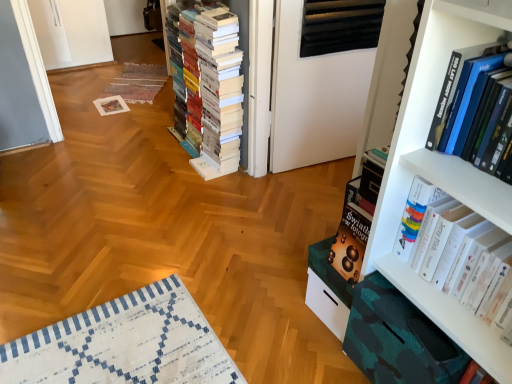
Describe the element at coordinates (441, 172) in the screenshot. The width and height of the screenshot is (512, 384). I see `white matte bookcase at right` at that location.

At what (x,y) coordinates should I click in order to perform the action: click on white matte bookcase at right. Please return your answer as a coordinate pair (x, y). Looking at the image, I should click on (441, 172).

Where is `white matte bookcase at right`? Image resolution: width=512 pixels, height=384 pixels. white matte bookcase at right is located at coordinates (441, 172).

Is white matte book at center, acting as the first book starting from the left, aimed at hardcover book at upper right, the third book in the back-to-front sequence?

No, white matte book at center, acting as the first book starting from the left, is not aimed at hardcover book at upper right, the third book in the back-to-front sequence.

Considering the sizes of white matte book at center, acting as the first book starting from the left, and hardcover book at upper right, the 2th book positioned from the left, in the image, is white matte book at center, acting as the first book starting from the left, wider or thinner than hardcover book at upper right, the 2th book positioned from the left,?

In the image, white matte book at center, acting as the first book starting from the left, appears to be wider than hardcover book at upper right, the 2th book positioned from the left.

Measure the distance from white matte book at center, the 3th book in the right-to-left sequence, to hardcover book at upper right, the 2th book positioned from the left.

A distance of 4.71 feet exists between white matte book at center, the 3th book in the right-to-left sequence, and hardcover book at upper right, the 2th book positioned from the left.

Considering the relative positions of white glossy book at right, which ranks as the 1th book in right-to-left order, and hardcover book at upper right, acting as the 1th book starting from the front, in the image provided, is white glossy book at right, which ranks as the 1th book in right-to-left order, to the right of hardcover book at upper right, acting as the 1th book starting from the front, from the viewer's perspective?

Yes.

Between white glossy book at right, positioned as the third book in left-to-right order, and hardcover book at upper right, acting as the 1th book starting from the front, which one has less height?

With less height is hardcover book at upper right, acting as the 1th book starting from the front.

How different are the orientations of white glossy book at right, which is the second book in front-to-back order, and hardcover book at upper right, the third book in the back-to-front sequence, in degrees?

The angle between the facing direction of white glossy book at right, which is the second book in front-to-back order, and the facing direction of hardcover book at upper right, the third book in the back-to-front sequence, is 0.000636 degrees.

Between point (425, 9) and point (215, 150), which one is positioned in front?

The point (425, 9) is in front.

Could you tell me if white matte bookcase at right is turned towards white matte book at center, the first book viewed from the back?

No.

Could white matte book at center, which appears as the third book when viewed from the front, be considered to be inside white matte bookcase at right?

Definitely not — white matte book at center, which appears as the third book when viewed from the front, is not inside white matte bookcase at right.

Considering the sizes of objects hardcover book at upper right, the 2th book positioned from the left, and white matte bookcase at right in the image provided, who is bigger, hardcover book at upper right, the 2th book positioned from the left, or white matte bookcase at right?

With larger size is white matte bookcase at right.

From the image's perspective, does hardcover book at upper right, the 2th book positioned from the left, appear higher than white matte bookcase at right?

No, from the image's perspective, hardcover book at upper right, the 2th book positioned from the left, is not above white matte bookcase at right.

Is hardcover book at upper right, the third book in the back-to-front sequence, beside white matte bookcase at right?

hardcover book at upper right, the third book in the back-to-front sequence, and white matte bookcase at right are clearly separated.

Looking at their sizes, would you say hardcover book at upper right, acting as the 1th book starting from the front, is wider or thinner than white matte bookcase at right?

Clearly, hardcover book at upper right, acting as the 1th book starting from the front, has more width compared to white matte bookcase at right.

Is white matte bookcase at right next to white glossy book at right, positioned as the third book in left-to-right order?

No, white matte bookcase at right is not in contact with white glossy book at right, positioned as the third book in left-to-right order.

Is white matte bookcase at right closer to camera compared to white glossy book at right, positioned as the third book in left-to-right order?

That is False.

Considering the sizes of objects white matte bookcase at right and white glossy book at right, the second book when ordered from back to front, in the image provided, who is thinner, white matte bookcase at right or white glossy book at right, the second book when ordered from back to front,?

white matte bookcase at right.

From the image's perspective, would you say white matte bookcase at right is positioned over white glossy book at right, which is the second book in front-to-back order?

Yes.

Does white matte book at center, the first book viewed from the back, come behind white glossy book at right, positioned as the third book in left-to-right order?

Yes, it is behind white glossy book at right, positioned as the third book in left-to-right order.

Is white matte book at center, acting as the first book starting from the left, positioned beyond the bounds of white glossy book at right, positioned as the third book in left-to-right order?

white matte book at center, acting as the first book starting from the left, lies outside white glossy book at right, positioned as the third book in left-to-right order,'s area.

Is white matte book at center, acting as the first book starting from the left, next to white glossy book at right, the second book when ordered from back to front, and touching it?

No, white matte book at center, acting as the first book starting from the left, is not next to white glossy book at right, the second book when ordered from back to front.

Is white matte book at center, acting as the first book starting from the left, facing towards white matte bookcase at right?

No, white matte book at center, acting as the first book starting from the left, is not facing towards white matte bookcase at right.

How much distance is there between white matte book at center, the first book viewed from the back, and white matte bookcase at right?

white matte book at center, the first book viewed from the back, and white matte bookcase at right are 4.53 feet apart.

From a real-world perspective, is white matte book at center, the 3th book in the right-to-left sequence, positioned under white matte bookcase at right based on gravity?

Yes, from a real-world perspective, white matte book at center, the 3th book in the right-to-left sequence, is beneath white matte bookcase at right.

Which of these two, white matte book at center, acting as the first book starting from the left, or white matte bookcase at right, stands taller?

Standing taller between the two is white matte bookcase at right.

Locate an element on the screen. The image size is (512, 384). the 2nd book positioned below the hardcover book at upper right, the third book in the back-to-front sequence (from a real-world perspective) is located at coordinates (213, 85).

There is a white glossy book at right, which is the second book in front-to-back order. Identify the location of the 1st book above it (from the image's perspective). (462, 92).

When comparing their distances from hardcover book at upper right, the third book in the back-to-front sequence, does white matte bookcase at right or white glossy book at right, positioned as the third book in left-to-right order, seem further?

Based on the image, white glossy book at right, positioned as the third book in left-to-right order, appears to be further to hardcover book at upper right, the third book in the back-to-front sequence.

In the scene shown: When comparing their distances from white glossy book at right, which ranks as the 1th book in right-to-left order, does hardcover book at upper right, the 2th book positioned from the left, or white matte bookcase at right seem closer?

white matte bookcase at right.

Estimate the real-world distances between objects in this image. Which object is further from white matte book at center, acting as the first book starting from the left, white glossy book at right, which is the second book in front-to-back order, or hardcover book at upper right, the second book in the right-to-left sequence?

hardcover book at upper right, the second book in the right-to-left sequence.

Based on their spatial positions, is white matte bookcase at right or white matte book at center, which appears as the third book when viewed from the front, closer to white glossy book at right, the second book when ordered from back to front?

The object closer to white glossy book at right, the second book when ordered from back to front, is white matte bookcase at right.

From the image, which object appears to be farther from white matte bookcase at right, white matte book at center, acting as the first book starting from the left, or hardcover book at upper right, acting as the 1th book starting from the front?

white matte book at center, acting as the first book starting from the left, lies further to white matte bookcase at right than the other object.

Consider the image. Considering their positions, is white matte bookcase at right positioned further to white glossy book at right, positioned as the third book in left-to-right order, than hardcover book at upper right, acting as the 1th book starting from the front?

hardcover book at upper right, acting as the 1th book starting from the front, is further to white glossy book at right, positioned as the third book in left-to-right order.

Looking at the image, which one is located further to white glossy book at right, which ranks as the 1th book in right-to-left order, hardcover book at upper right, the third book in the back-to-front sequence, or white matte book at center, which appears as the third book when viewed from the front?

Among the two, white matte book at center, which appears as the third book when viewed from the front, is located further to white glossy book at right, which ranks as the 1th book in right-to-left order.

Looking at this image, considering their positions, is white matte book at center, the 3th book in the right-to-left sequence, positioned closer to hardcover book at upper right, the third book in the back-to-front sequence, than white glossy book at right, positioned as the third book in left-to-right order?

white glossy book at right, positioned as the third book in left-to-right order.

At what (x,y) coordinates should I click in order to perform the action: click on book that lies between white matte bookcase at right and white glossy book at right, which ranks as the 1th book in right-to-left order, from top to bottom. Please return your answer as a coordinate pair (x, y). The height and width of the screenshot is (384, 512). Looking at the image, I should click on (462, 92).

You are a GUI agent. You are given a task and a screenshot of the screen. Output one action in this format:
    pyautogui.click(x=<x>, y=<y>)
    Task: Click on the bookcase positioned between white glossy book at right, which ranks as the 1th book in right-to-left order, and white matte book at center, the 3th book in the right-to-left sequence, from near to far
    This screenshot has height=384, width=512.
    Given the screenshot: What is the action you would take?
    pyautogui.click(x=441, y=172)

Image resolution: width=512 pixels, height=384 pixels. What are the coordinates of `book positioned between hardcover book at upper right, the third book in the back-to-front sequence, and white matte book at center, the 3th book in the right-to-left sequence, from near to far` in the screenshot? It's located at 443,237.

Image resolution: width=512 pixels, height=384 pixels. In order to click on bookcase located between hardcover book at upper right, the third book in the back-to-front sequence, and white matte book at center, the first book viewed from the back, in the depth direction in this screenshot , I will do `click(441, 172)`.